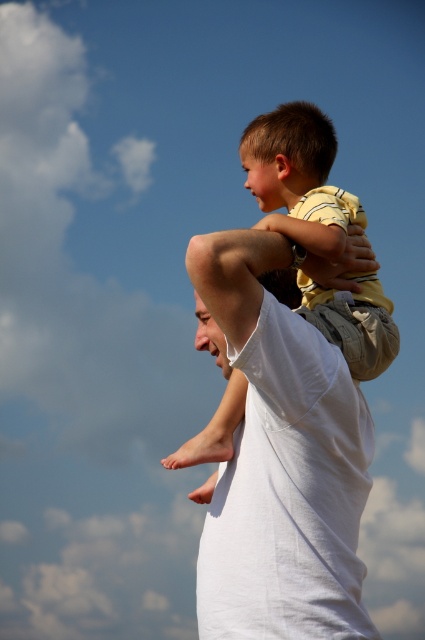
Does white cotton shirt at center have a lesser width compared to light brown cotton shirt at center?

Yes, white cotton shirt at center is thinner than light brown cotton shirt at center.

Is point (272, 500) farther from viewer compared to point (266, 148)?

No.

Find the location of a particular element. white cotton shirt at center is located at coordinates (278, 458).